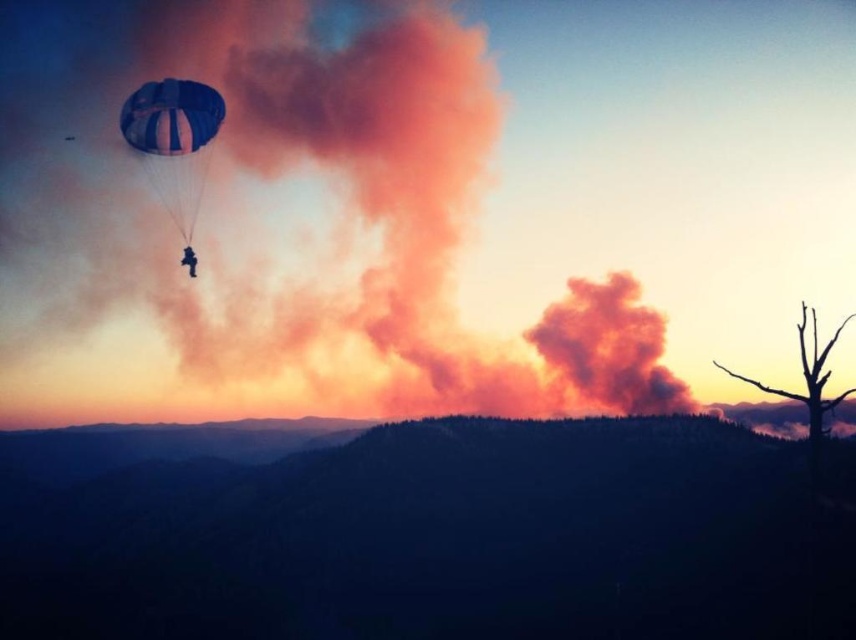
You are an observer looking at the image. You see the green textured hillside at center and the blue fabric parachute at upper left. Which object is positioned to the left of the other?

The green textured hillside at center is to the left of the blue fabric parachute at upper left.

You are an observer looking at the sunset scene. You notice two parachutes in the upper left corner. One is labeled as blue striped parachute at upper left and the other as blue fabric parachute at upper left. Which of these two parachutes appears larger in height?

The blue striped parachute at upper left is much taller than the blue fabric parachute at upper left, so it appears larger in height.

You are a pilot navigating a small plane and see the image. There is a green textured hillside at center marked by point (441,540). Your plane is at point 0.7, 0.6. Can you safely land on the green textured hillside at center?

The point (441,540) marks the green textured hillside at center, which is your target landing zone. Since your current position is at 0.7, 0.6, you are slightly to the left and above the hillside. However, the description does not provide information about the hillside terrain or space required for landing. Without knowing if the hillside is flat enough or large enough for a safe landing, it is not advisable to proceed without further details.